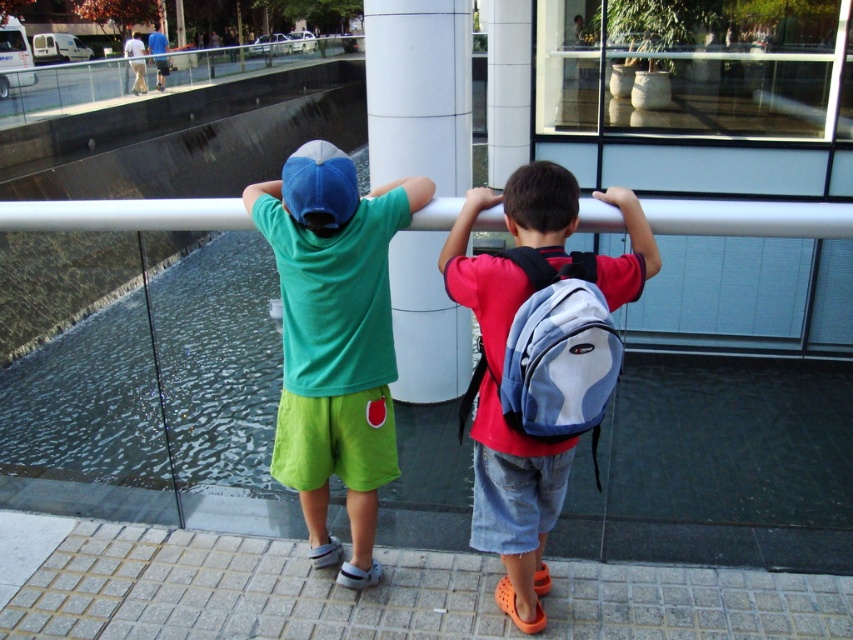
Question: Which point is closer to the camera?

Choices:
 (A) (421, 179)
 (B) (461, 106)

Answer: (A)

Question: Does green matte t-shirt at center lie behind white smooth pillar at center?

Choices:
 (A) no
 (B) yes

Answer: (A)

Question: Where is white smooth pillar at center located in relation to blue fabric backpack at center in the image?

Choices:
 (A) below
 (B) above

Answer: (B)

Question: Which point is farther to the camera?

Choices:
 (A) blue denim shorts at center
 (B) green matte t-shirt at center

Answer: (B)

Question: Which of the following is the closest to the observer?

Choices:
 (A) (529, 285)
 (B) (303, 292)
 (C) (405, 168)

Answer: (A)

Question: Is blue denim shorts at center below blue fabric backpack at center?

Choices:
 (A) yes
 (B) no

Answer: (A)